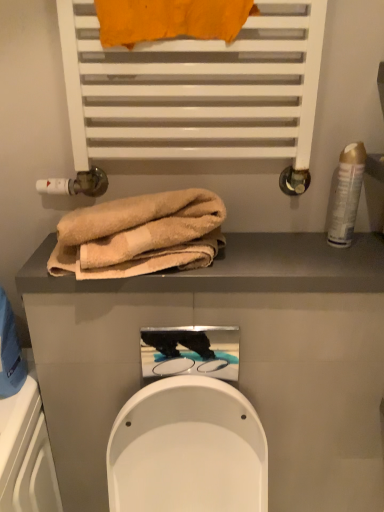
Locate an element on the screen. The height and width of the screenshot is (512, 384). vacant space to the left of gold metallic can at right is located at coordinates (277, 250).